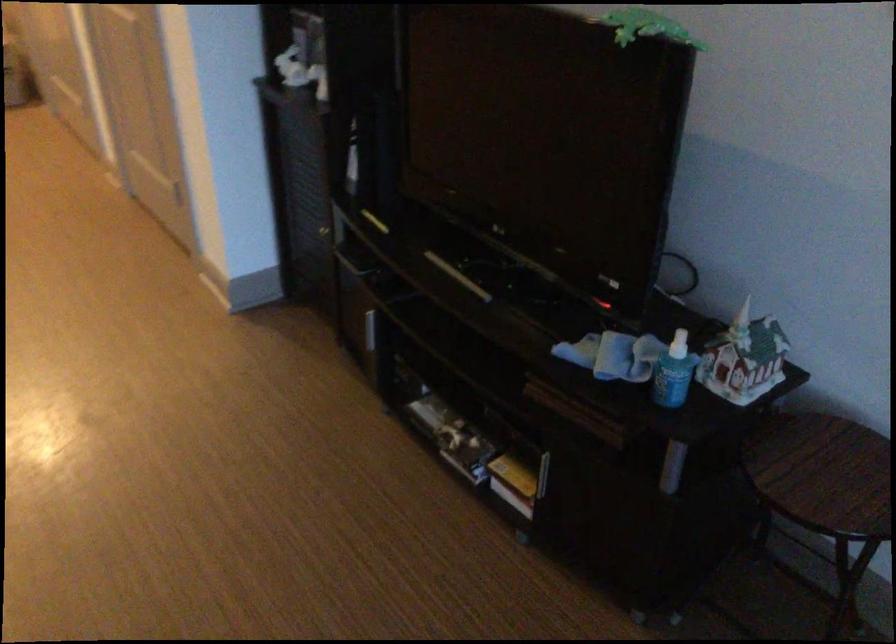
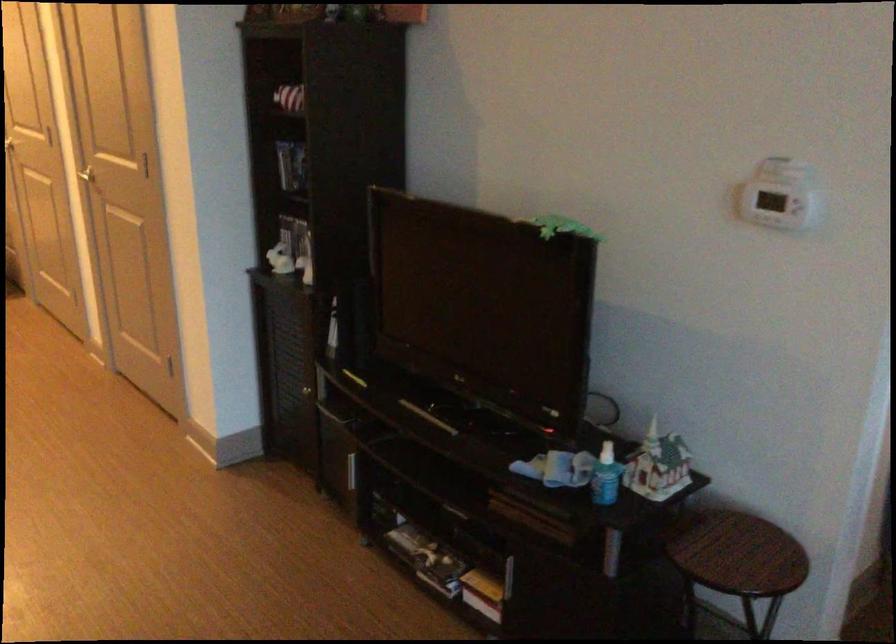
In the second image, find the point that corresponds to [673,370] in the first image.

(606, 476)